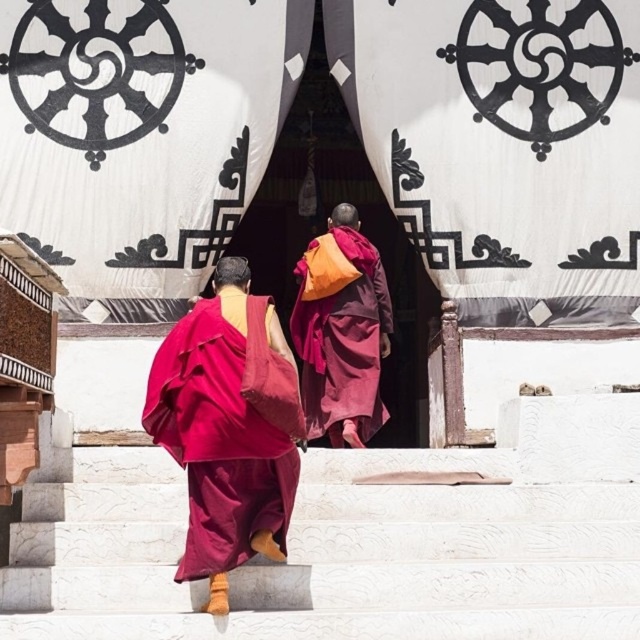
Question: In this image, where is white marble stairs at center located relative to maroon silk robe at center?

Choices:
 (A) left
 (B) right

Answer: (B)

Question: Which point is closer to the camera taking this photo?

Choices:
 (A) (16, 566)
 (B) (328, 436)
 (C) (188, 332)

Answer: (A)

Question: Based on their relative distances, which object is farther from the maroon woolen robe at center?

Choices:
 (A) white marble stairs at center
 (B) maroon silk robe at center

Answer: (B)

Question: Among these points, which one is nearest to the camera?

Choices:
 (A) (307, 483)
 (B) (349, 225)

Answer: (A)

Question: Is white marble stairs at center behind maroon woolen robe at center?

Choices:
 (A) no
 (B) yes

Answer: (A)

Question: Can you confirm if white marble stairs at center is positioned below maroon silk robe at center?

Choices:
 (A) yes
 (B) no

Answer: (A)